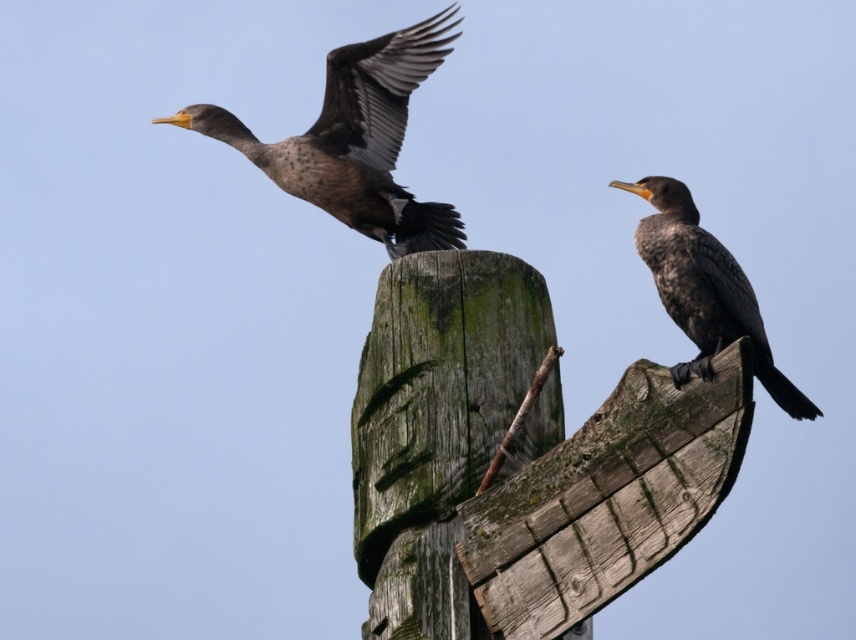
Can you confirm if brown speckled feathers at upper left is smaller than dark brown feathers at center?

No, brown speckled feathers at upper left is not smaller than dark brown feathers at center.

Does point (339, 92) lie behind point (673, 188)?

Yes, it is.

Which is in front, point (331, 196) or point (732, 268)?

Point (732, 268)

You are a GUI agent. You are given a task and a screenshot of the screen. Output one action in this format:
    pyautogui.click(x=<x>, y=<y>)
    Task: Click on the brown speckled feathers at upper left
    This screenshot has height=640, width=856.
    Given the screenshot: What is the action you would take?
    pyautogui.click(x=354, y=140)